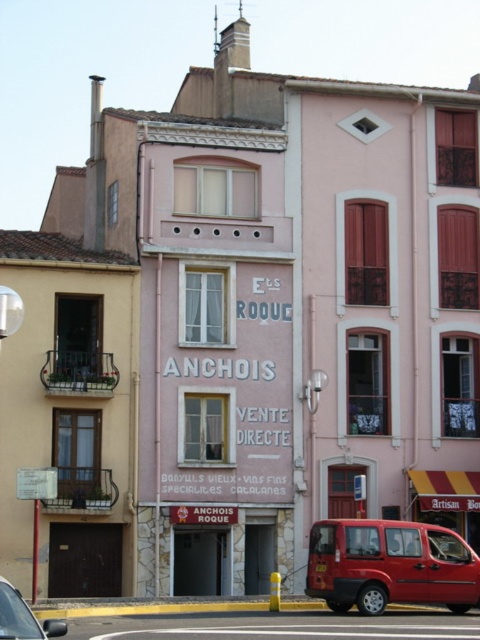
Question: Can you confirm if metallic red van at lower center is bigger than metallic silver car at lower left?

Choices:
 (A) yes
 (B) no

Answer: (B)

Question: Which point is farther to the camera?

Choices:
 (A) (308, 576)
 (B) (6, 618)

Answer: (A)

Question: Which object appears farthest from the camera in this image?

Choices:
 (A) metallic red van at lower center
 (B) metallic silver car at lower left

Answer: (A)

Question: Does metallic red van at lower center have a lesser width compared to metallic silver car at lower left?

Choices:
 (A) no
 (B) yes

Answer: (B)

Question: Is metallic red van at lower center above metallic silver car at lower left?

Choices:
 (A) no
 (B) yes

Answer: (A)